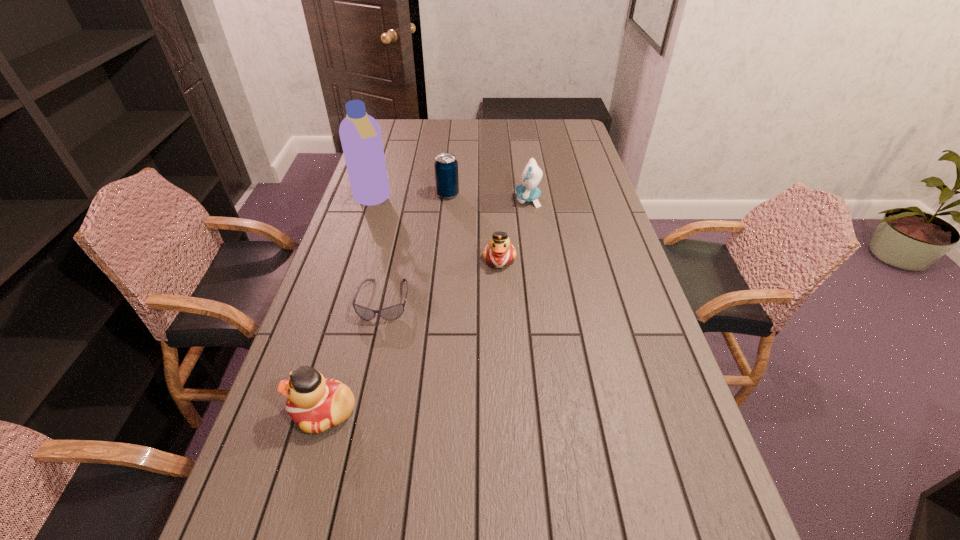
The height and width of the screenshot is (540, 960). Find the location of `the nearer duck`. the nearer duck is located at coordinates (316, 404).

Where is `the taller duck`? The width and height of the screenshot is (960, 540). the taller duck is located at coordinates (316, 404).

At what (x,y) coordinates should I click in order to perform the action: click on the second shortest object. Please return your answer as a coordinate pair (x, y). The width and height of the screenshot is (960, 540). Looking at the image, I should click on (499, 252).

Find the location of a particular element. Image resolution: width=960 pixels, height=540 pixels. the second object from right to left is located at coordinates (499, 252).

You are a GUI agent. You are given a task and a screenshot of the screen. Output one action in this format:
    pyautogui.click(x=<x>, y=<y>)
    Task: Click on the soda can
    
    Given the screenshot: What is the action you would take?
    pyautogui.click(x=445, y=166)

Locate an element on the screen. Image resolution: width=960 pixels, height=540 pixels. the rightmost object is located at coordinates (527, 191).

You are a GUI agent. You are given a task and a screenshot of the screen. Output one action in this format:
    pyautogui.click(x=<x>, y=<y>)
    Task: Click on the shampoo
    This screenshot has width=960, height=540.
    Given the screenshot: What is the action you would take?
    [x=360, y=134]

Locate an element on the screen. Image resolution: width=960 pixels, height=540 pixels. the fifth farthest object is located at coordinates (393, 312).

I want to click on sunglasses, so click(x=393, y=312).

Identify the location of free point located on the face of the right duck. (501, 286).